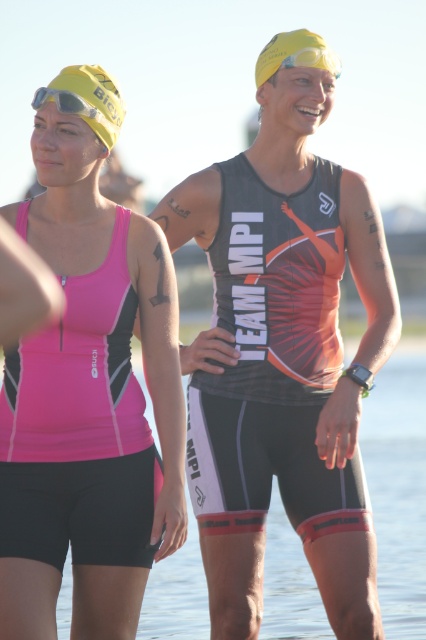
You are a photographer positioned to capture the two athletes. You need to ensure that the pink matte triathlon suit at left and the yellow matte swim cap at upper left are both clearly visible in your shot. Given their sizes, which object will require more space in the frame to avoid being cropped?

The pink matte triathlon suit at left requires more space in the frame because its width surpasses that of the yellow matte swim cap at upper left, so it is wider and needs adequate room to prevent cropping.

You are a photographer at a triathlon event. You need to position your camera to capture the pink matte triathlon suit at left. Where should you aim your camera?

You should aim your camera at point (92, 376) to capture the pink matte triathlon suit at left.

You are a photographer at a triathlon event. You need to capture a photo where the matte black triathlon suit at center is visible above the yellow matte swim cap at upper center. Is this possible given their current positions?

The matte black triathlon suit at center is currently below the yellow matte swim cap at upper center, so it cannot be visible above it in this position.